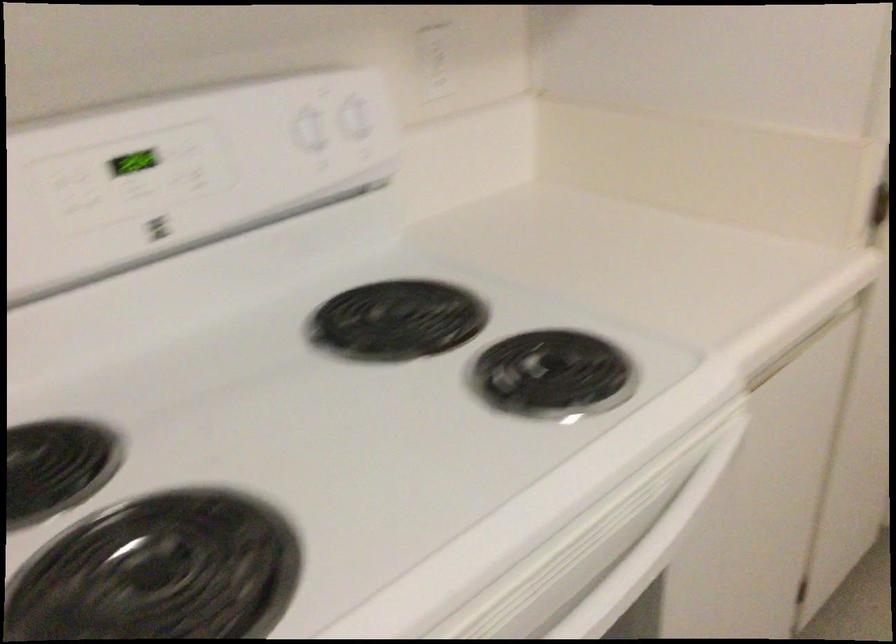
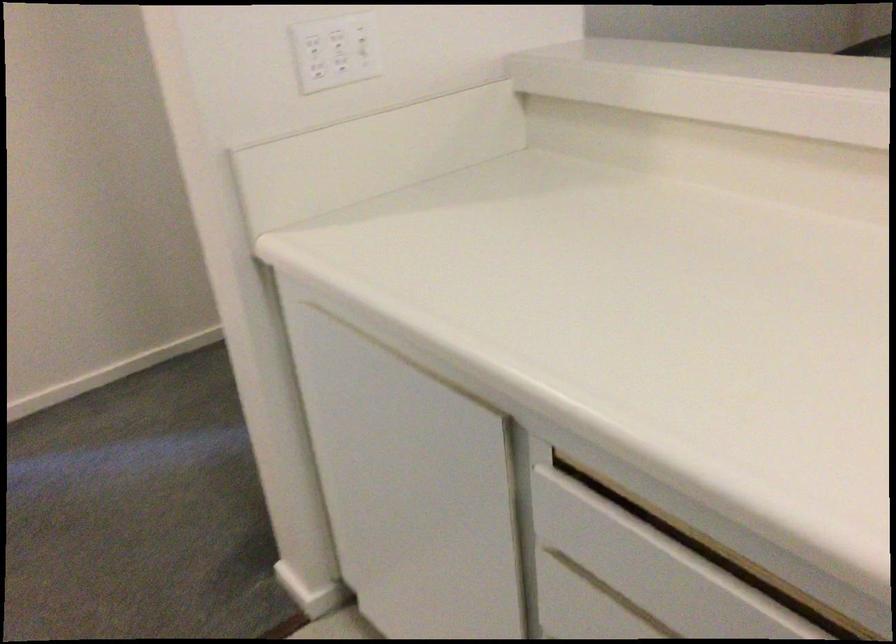
How did the camera likely rotate?

The rotation direction of the camera is right-down.